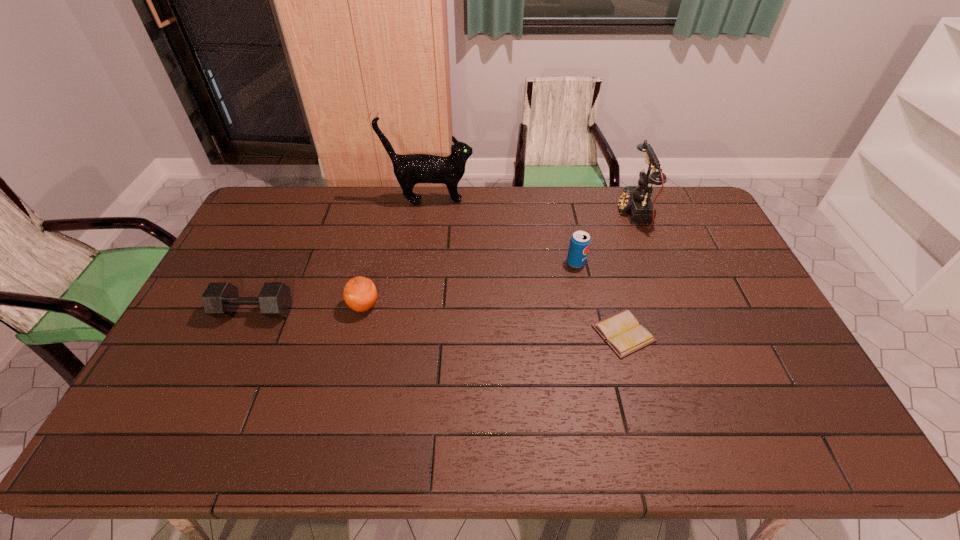
Locate an element on the screen. vacant space located 0.370m on the dial of the rightmost object is located at coordinates (518, 213).

At what (x,y) coordinates should I click in order to perform the action: click on free spot located 0.220m on the left of the fourth nearest object. Please return your answer as a coordinate pair (x, y). Looking at the image, I should click on (499, 263).

The height and width of the screenshot is (540, 960). Identify the location of free spot located 0.250m on the right of the orange. (465, 306).

The image size is (960, 540). Find the location of `vacant space located on the back of the leftmost object`. vacant space located on the back of the leftmost object is located at coordinates (275, 268).

Image resolution: width=960 pixels, height=540 pixels. What are the coordinates of `blank space located 0.320m on the right of the diary` in the screenshot? It's located at (768, 334).

Identify the location of cat that is at the far edge. The image size is (960, 540). (411, 169).

The height and width of the screenshot is (540, 960). In order to click on telephone at the far edge in this screenshot , I will do `click(635, 200)`.

Identify the location of object present at the left edge. (221, 299).

At what (x,y) coordinates should I click in order to perform the action: click on vacant space at the far edge of the desktop. Please return your answer as a coordinate pair (x, y). Looking at the image, I should click on (376, 212).

You are a GUI agent. You are given a task and a screenshot of the screen. Output one action in this format:
    pyautogui.click(x=<x>, y=<y>)
    Task: Click on the free location at the near edge
    
    Given the screenshot: What is the action you would take?
    pyautogui.click(x=487, y=424)